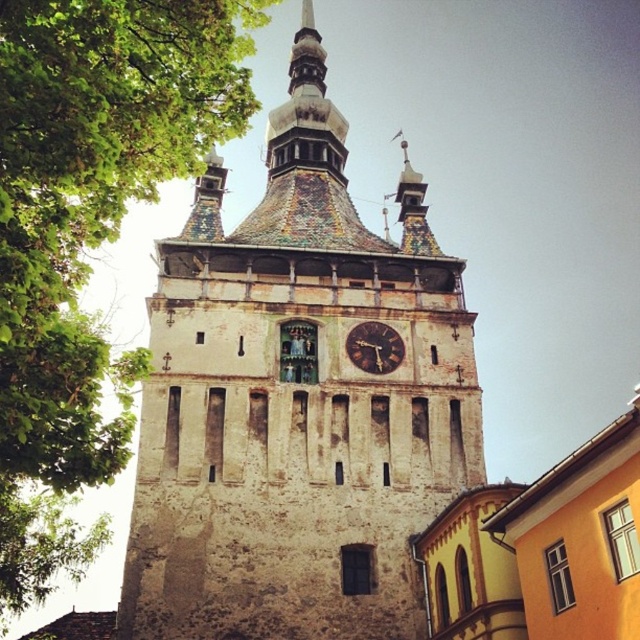
Question: Is weathered stone clock tower at center positioned in front of brown wooden clock at center?

Choices:
 (A) no
 (B) yes

Answer: (B)

Question: Estimate the real-world distances between objects in this image. Which object is closer to the weathered stone clock tower at center?

Choices:
 (A) green leafy tree at upper left
 (B) brown wooden clock at center

Answer: (B)

Question: Which object appears closest to the camera in this image?

Choices:
 (A) green leafy tree at upper left
 (B) brown wooden clock at center

Answer: (A)

Question: Can you confirm if weathered stone clock tower at center is positioned to the right of green leafy tree at upper left?

Choices:
 (A) yes
 (B) no

Answer: (A)

Question: Which point appears farthest from the camera in this image?

Choices:
 (A) (280, 310)
 (B) (28, 51)

Answer: (A)

Question: Can you confirm if green leafy tree at upper left is bigger than brown wooden clock at center?

Choices:
 (A) yes
 (B) no

Answer: (A)